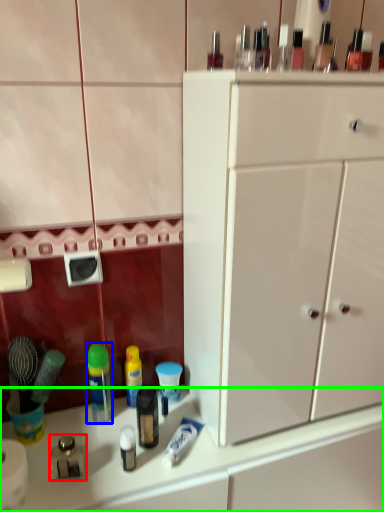
Question: Which is nearer to the toiletry (highlighted by a red box)? mouthwash (highlighted by a blue box) or counter top (highlighted by a green box).

Choices:
 (A) mouthwash
 (B) counter top

Answer: (A)